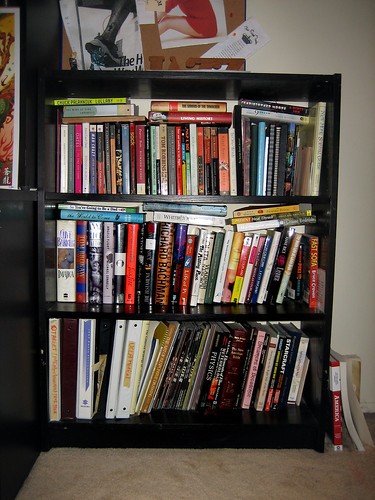
You are a GUI agent. You are given a task and a screenshot of the screen. Output one action in this format:
    pyautogui.click(x=<x>, y=<y>)
    Task: Click on the binder
    
    Given the screenshot: What is the action you would take?
    pyautogui.click(x=56, y=389), pyautogui.click(x=66, y=384), pyautogui.click(x=82, y=379), pyautogui.click(x=102, y=364), pyautogui.click(x=115, y=361), pyautogui.click(x=133, y=357)